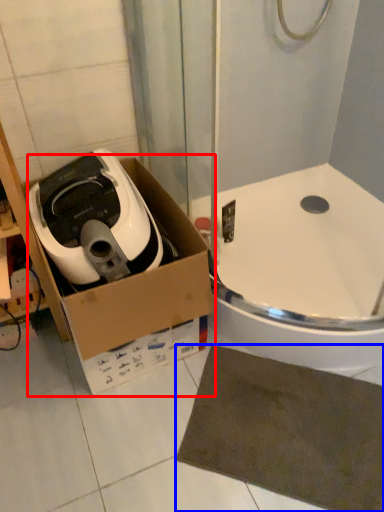
Question: Which point is closer to the camera, cardboard box (highlighted by a red box) or bath mat (highlighted by a blue box)?

Choices:
 (A) cardboard box
 (B) bath mat

Answer: (A)